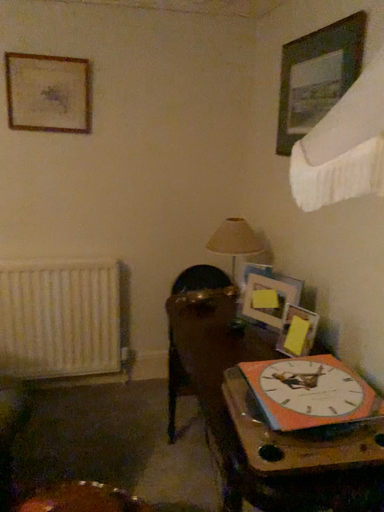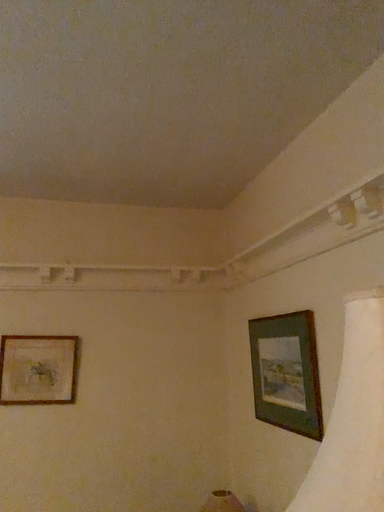
Question: How did the camera likely rotate when shooting the video?

Choices:
 (A) rotated upward
 (B) rotated downward

Answer: (A)